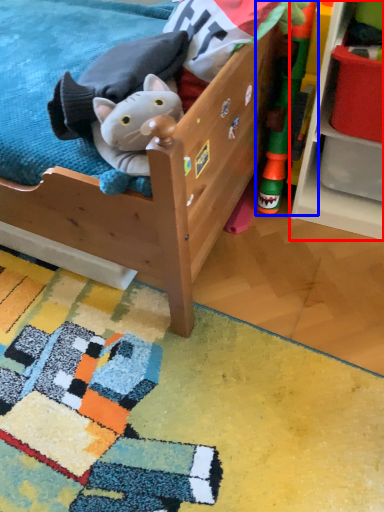
Question: Which object appears farthest to the camera in this image, shelf (highlighted by a red box) or toy (highlighted by a blue box)?

Choices:
 (A) shelf
 (B) toy

Answer: (B)